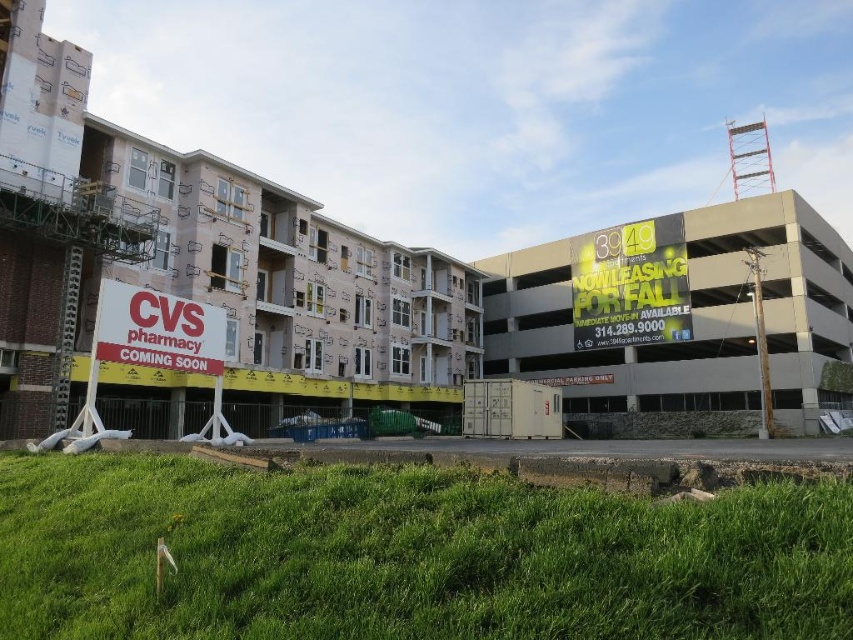
You are a delivery driver who needs to park your truck near the white plastic cvs pharmacy sign at lower left. The parking garage at right has height restrictions. Can you determine if your truck, which is 15 feet tall, can enter the gray concrete parking garage at right based on the height comparison between the two objects?

The gray concrete parking garage at right is taller than the white plastic cvs pharmacy sign at lower left. However, without knowing the exact height of the sign, we cannot determine if the parking garage is tall enough for your 15 feet truck. Please check the actual height measurements or consult the site plans for accurate information.

You are a construction worker standing at the point labeled point [699,400] and need to reach the point labeled point [672,300]. Which direction should you move to get closer to your destination?

Since point [699,400] is closer to the viewer than point [672,300], you should move backward to get closer to point [672,300].

You are a delivery driver approaching the construction site and need to locate the CVS pharmacy sign. You see the gray concrete parking garage at right and the yellow reflective sign at upper right. Which object is bigger in size?

The gray concrete parking garage at right is larger in size compared to the yellow reflective sign at upper right, so the parking garage is bigger.